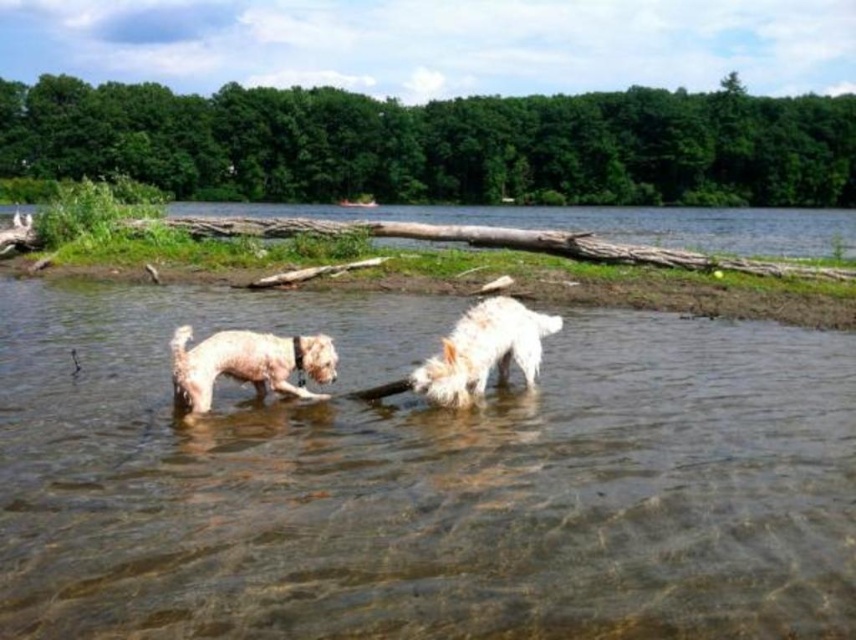
You are a photographer trying to capture a shot of the white fluffy dog at center and the clear water at center. From your current position, which object is located to the right?

The white fluffy dog at center is located to the right of the clear water at center.

You are a photographer standing at the lakeside. You want to take a photo of the white fluffy dog at center and the clear water at center. If your camera can focus on objects within 1.5 meters, will both subjects be in focus?

The clear water at center is 1.64 meters away from the white fluffy dog at center. Since the camera can only focus within 1.5 meters, the distance between them exceeds the focus range. Therefore, both subjects cannot be in focus simultaneously.

You are standing at the lakeside and want to retrieve the brown rough log at upper center. Given that you can only walk on the sandy shore and the shallow water, which is safe up to 50 feet from the viewer, can you reach the log safely?

The brown rough log at upper center is 51.92 feet from viewer, which exceeds the safe distance of 50 feet in shallow water. Therefore, you cannot safely retrieve it within the safe zone.